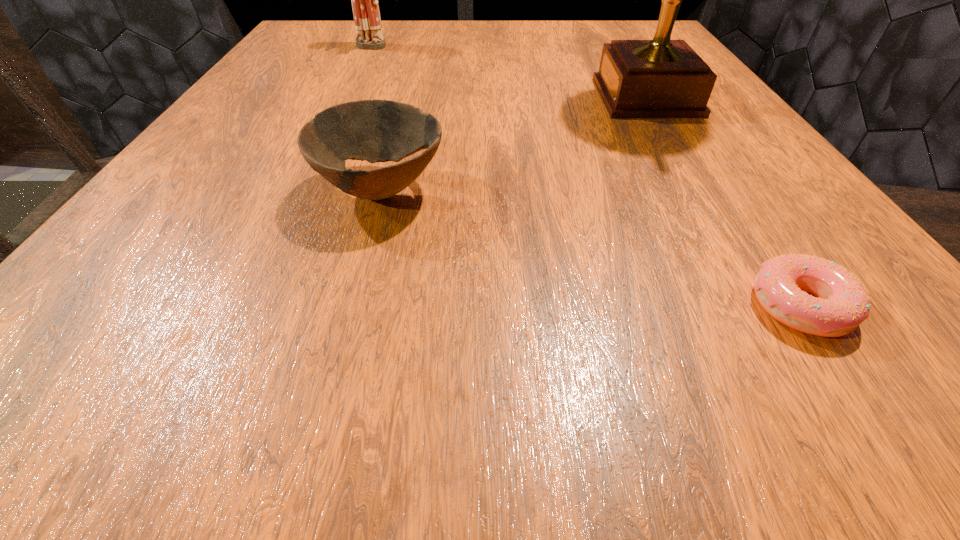
I want to click on free spot that satisfies the following two spatial constraints: 1. on the front-facing side of the second shortest object; 2. on the left side of the second tallest object, so click(x=301, y=190).

I want to click on vacant space that satisfies the following two spatial constraints: 1. on the plaque of the award; 2. on the left side of the nearest object, so click(x=772, y=306).

This screenshot has height=540, width=960. Identify the location of free space that satisfies the following two spatial constraints: 1. on the front-facing side of the shortest object; 2. on the right side of the figurine. (245, 306).

The image size is (960, 540). What are the coordinates of `blank area in the image that satisfies the following two spatial constraints: 1. on the front-facing side of the farthest object; 2. on the left side of the shortest object` in the screenshot? It's located at (245, 306).